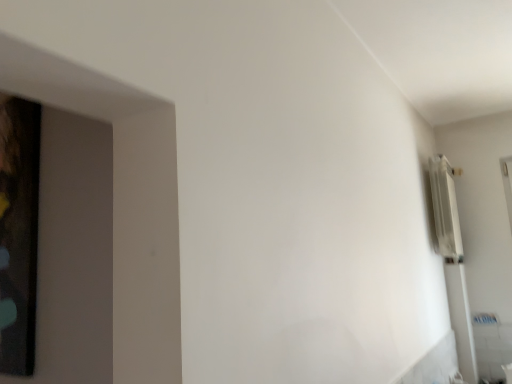
Question: In the image, is white metallic radiator at upper right on the left side or the right side of wooden picture frame at left?

Choices:
 (A) right
 (B) left

Answer: (A)

Question: In terms of width, does white metallic radiator at upper right look wider or thinner when compared to wooden picture frame at left?

Choices:
 (A) thin
 (B) wide

Answer: (B)

Question: Is white metallic radiator at upper right taller or shorter than wooden picture frame at left?

Choices:
 (A) tall
 (B) short

Answer: (B)

Question: Considering their positions, is wooden picture frame at left located in front of or behind white metallic radiator at upper right?

Choices:
 (A) behind
 (B) front

Answer: (B)

Question: Based on their sizes in the image, would you say wooden picture frame at left is bigger or smaller than white metallic radiator at upper right?

Choices:
 (A) big
 (B) small

Answer: (B)

Question: From a real-world perspective, is wooden picture frame at left physically located above or below white metallic radiator at upper right?

Choices:
 (A) below
 (B) above

Answer: (A)

Question: Looking at their shapes, would you say wooden picture frame at left is wider or thinner than white metallic radiator at upper right?

Choices:
 (A) thin
 (B) wide

Answer: (A)